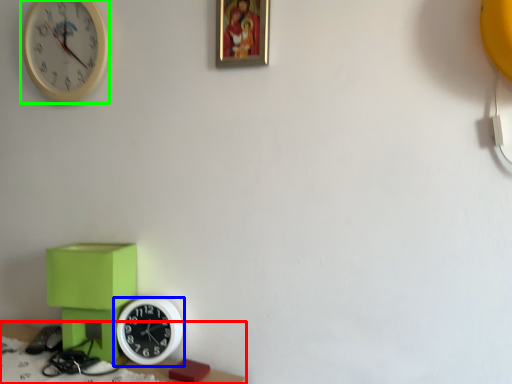
Question: Based on their relative distances, which object is nearer to table (highlighted by a red box)? Choose from wall clock (highlighted by a blue box) and wall clock (highlighted by a green box).

Choices:
 (A) wall clock
 (B) wall clock

Answer: (A)